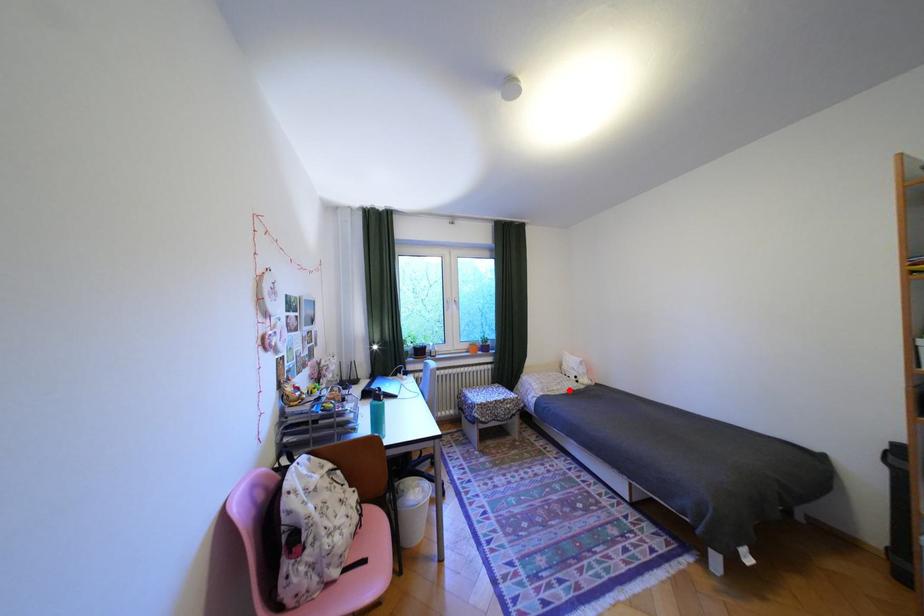
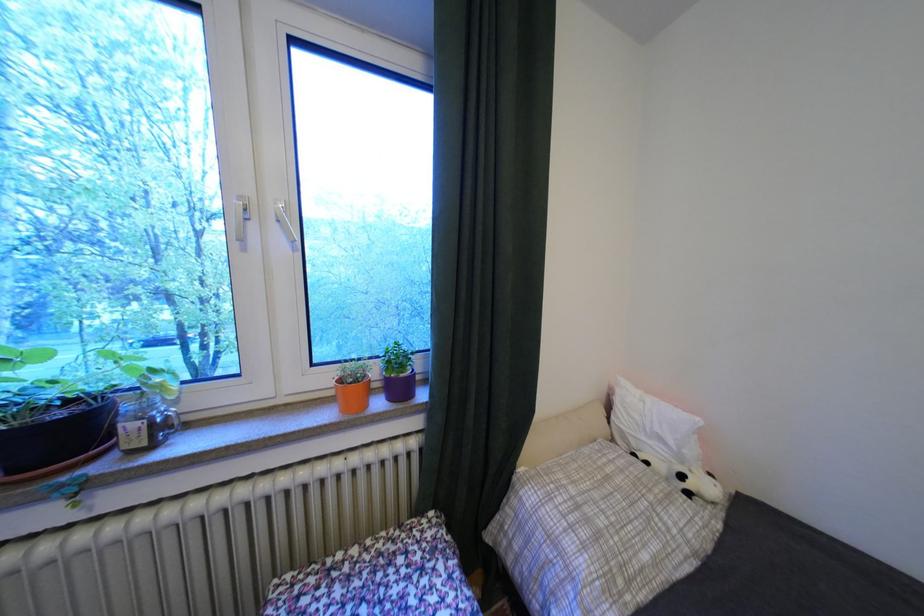
Find the pixel in the second image that matches the highlighted location in the first image.

(667, 562)